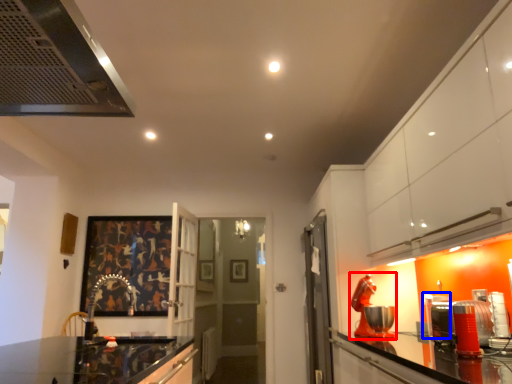
Question: Which object appears farthest to the camera in this image, appliance (highlighted by a red box) or appliance (highlighted by a blue box)?

Choices:
 (A) appliance
 (B) appliance

Answer: (B)